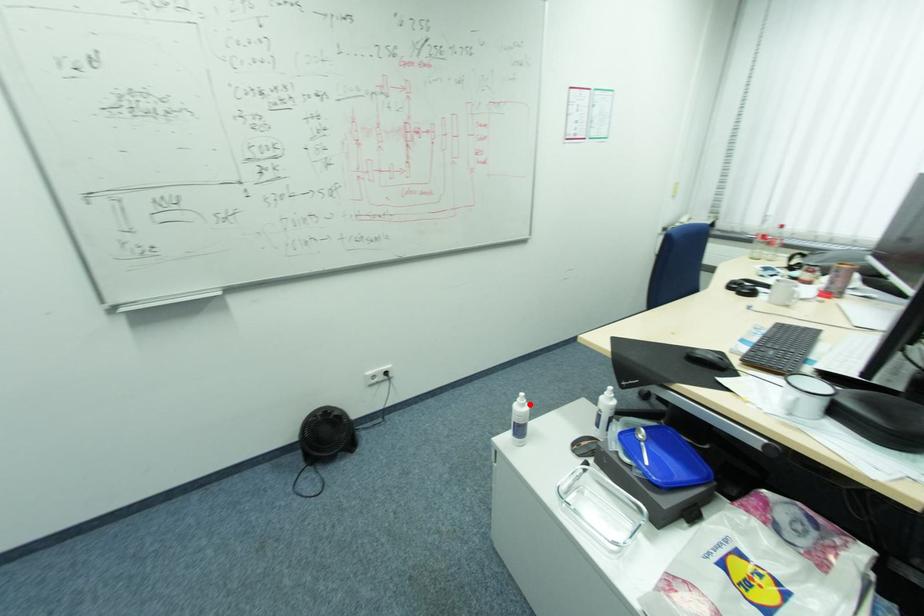
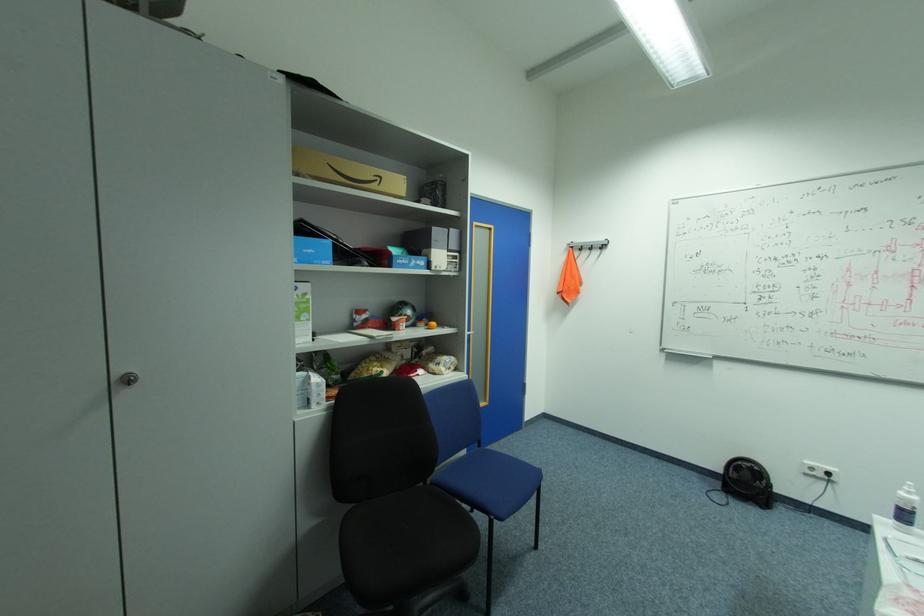
Locate, in the second image, the point that corresponds to the highlighted location in the first image.

(916, 493)